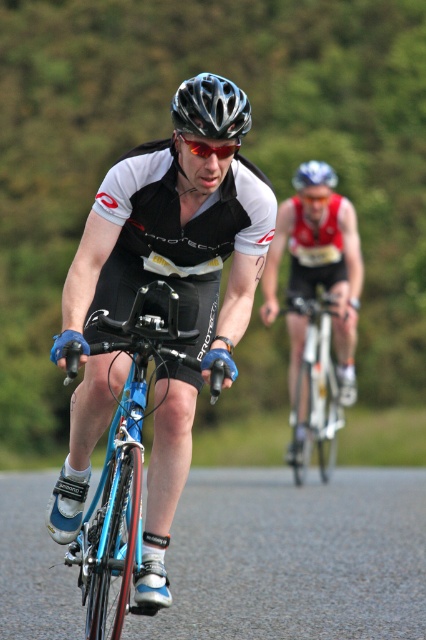
You are a photographer trying to capture both cyclists in a single shot. Given that the matte black helmet at center is taller than the blue matte helmet at upper center, which cyclist should you focus on to ensure both are in frame?

Focus on the cyclist with the matte black helmet at center since it is taller and likely closer, allowing the blue matte helmet at upper center to remain in the frame as well.

You are a photographer trying to capture both cyclists clearly. The matte black helmet at center belongs to the front cyclist, and the blue matte helmet at upper center is on the following cyclist. Based on their positions, which cyclist is closer to the camera?

The matte black helmet at center is above the blue matte helmet at upper center, meaning the cyclist with the matte black helmet at center is closer to the camera.

You are a drone operator monitoring a cycling race. You need to ensure the distance between the two cyclists is safe for aerial filming. The minimum safe distance for your drone is 5 meters. Based on the image, is the distance between the matte black helmet at center and the blue matte helmet at upper center sufficient?

The matte black helmet at center is 8.07 meters from the blue matte helmet at upper center, which is greater than the 5 meter minimum safe distance. The distance is sufficient for safe aerial filming.